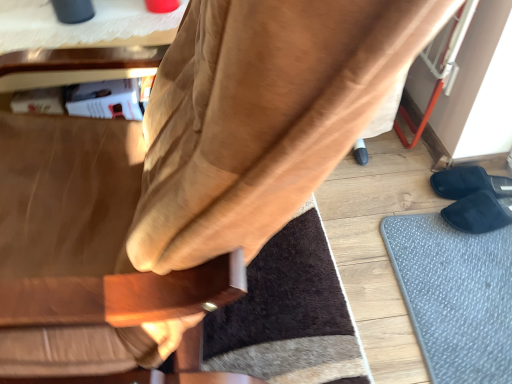
Locate an element on the screen. The width and height of the screenshot is (512, 384). gray textured bath mat at lower right is located at coordinates (455, 295).

Describe the element at coordinates (455, 295) in the screenshot. I see `gray textured bath mat at lower right` at that location.

Find the location of a particular element. This screenshot has width=512, height=384. gray textured bath mat at lower right is located at coordinates (455, 295).